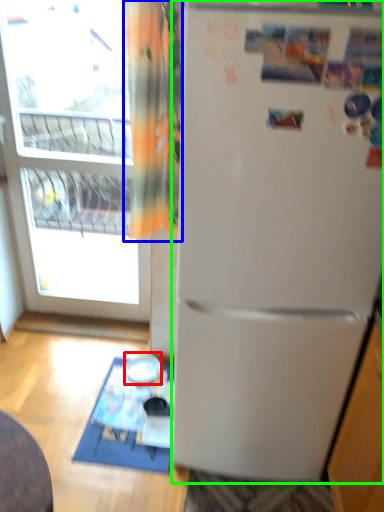
Question: Based on their relative distances, which object is nearer to appliance (highlighted by a red box)? Choose from curtain (highlighted by a blue box) and refrigerator (highlighted by a green box).

Choices:
 (A) curtain
 (B) refrigerator

Answer: (B)